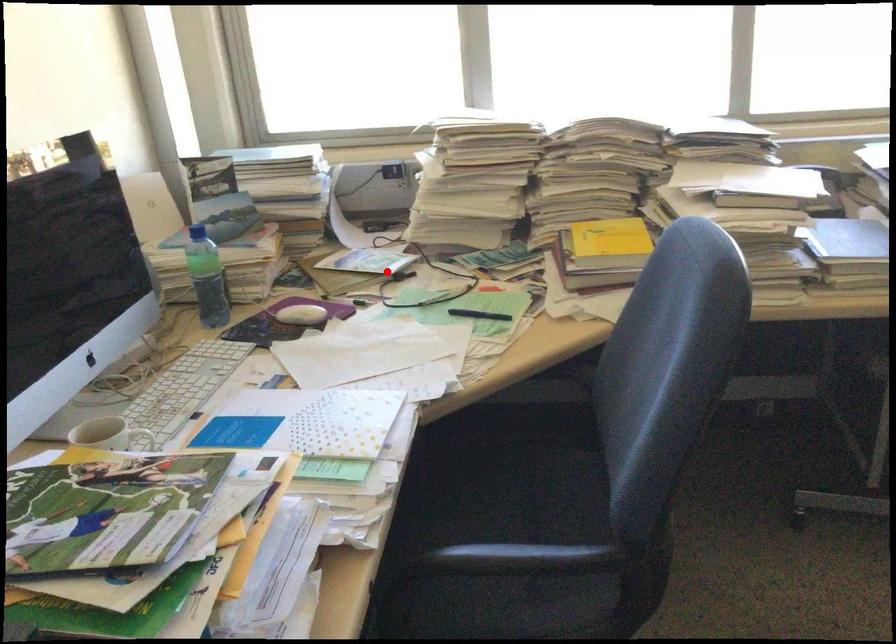
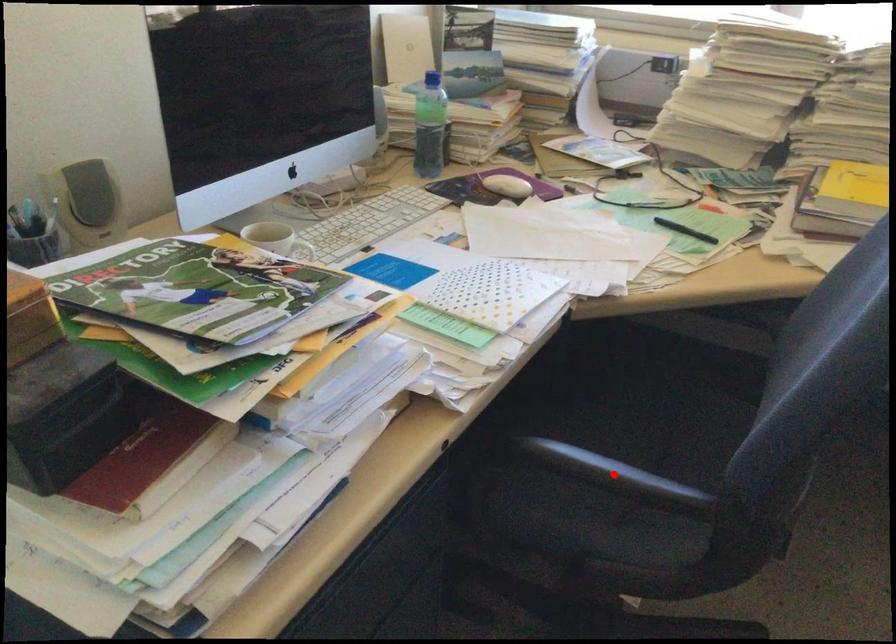
I am providing you with two images of the same scene from different viewpoints. A red point is marked on the first image and another point is marked on the second image. Do the highlighted points in image1 and image2 indicate the same real-world spot?

No